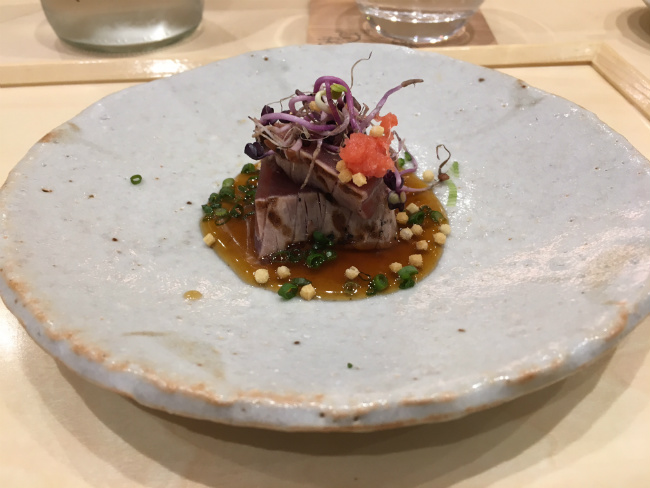
Where is `plate`? The image size is (650, 488). plate is located at coordinates (136, 205).